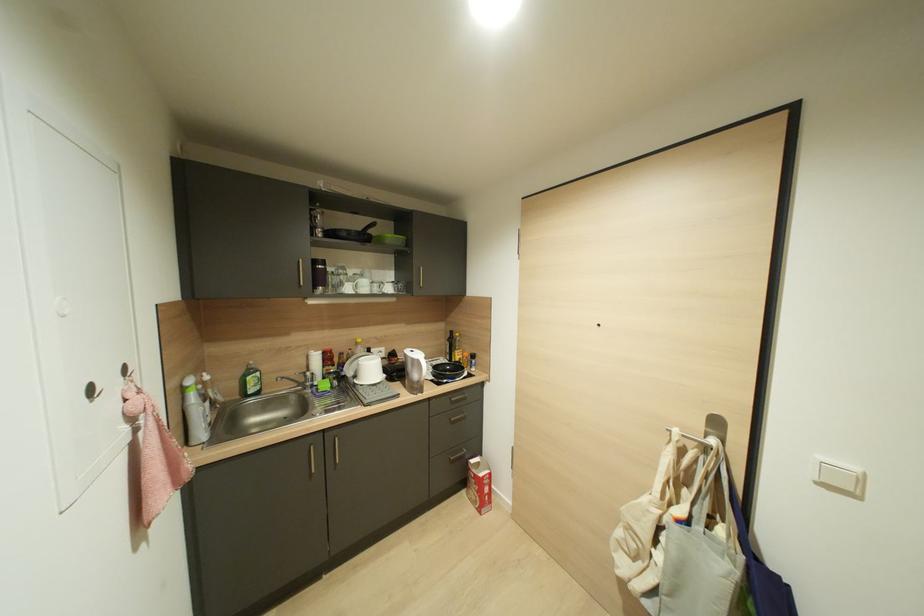
The width and height of the screenshot is (924, 616). I want to click on white kettle handle, so click(x=299, y=379).